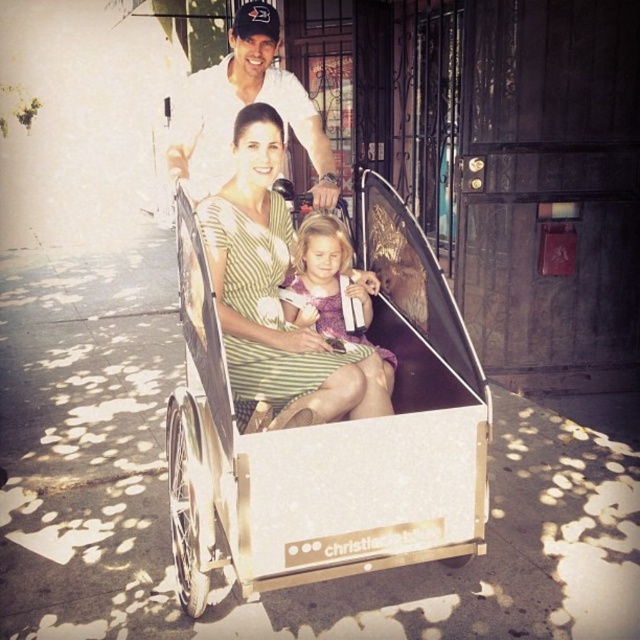
Does point (266, 29) lie in front of point (342, 257)?

Yes, it is in front of point (342, 257).

Who is more distant from viewer, [268,28] or [364,310]?

The point [364,310] is more distant.

Is point (296, 102) positioned in front of point (339, 317)?

No, (296, 102) is further to viewer.

Find the location of a particular element. This screenshot has height=640, width=640. white cotton shirt at upper center is located at coordinates (241, 106).

Does green striped dress at center have a greater height compared to white cotton shirt at upper center?

Yes, green striped dress at center is taller than white cotton shirt at upper center.

Does green striped dress at center have a lesser height compared to white cotton shirt at upper center?

No.

The image size is (640, 640). I want to click on green striped dress at center, so click(x=275, y=296).

Between point (292, 568) and point (216, 122), which one is positioned behind?

Positioned behind is point (216, 122).

From the picture: Is white metallic wagon at center to the left of white cotton shirt at upper center from the viewer's perspective?

No, white metallic wagon at center is not to the left of white cotton shirt at upper center.

Does point (204, 595) come farther from viewer compared to point (244, 68)?

No, it is not.

Locate an element on the screen. white metallic wagon at center is located at coordinates (332, 436).